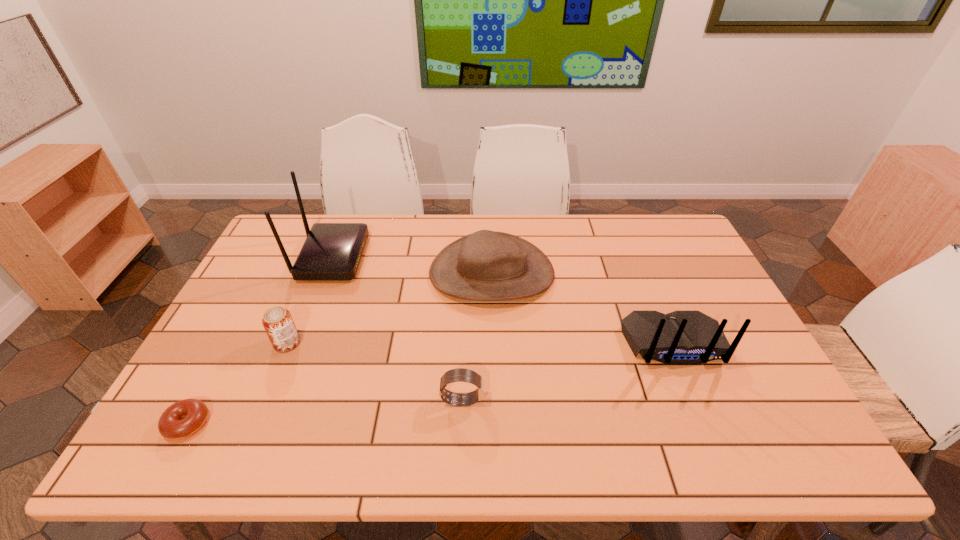
Locate an element on the screen. vacant space located 0.210m on the back of the fifth shortest object is located at coordinates (716, 448).

Identify the location of vacant area located on the front of the cowboy hat. (494, 357).

Image resolution: width=960 pixels, height=540 pixels. Find the location of `free region located on the right of the beer can`. free region located on the right of the beer can is located at coordinates (355, 343).

Identify the location of vacant area located 0.050m on the face of the watch. (504, 400).

The image size is (960, 540). I want to click on free location located on the back of the leftmost object, so click(x=206, y=387).

Where is `router that is positioned at the far edge`? The image size is (960, 540). router that is positioned at the far edge is located at coordinates (332, 251).

This screenshot has height=540, width=960. In order to click on cowboy hat situated at the far edge in this screenshot , I will do point(486,265).

At what (x,y) coordinates should I click in order to perform the action: click on object that is positioned at the near edge. Please return your answer as a coordinate pair (x, y). Looking at the image, I should click on (182, 419).

Where is `router that is at the left edge`? Image resolution: width=960 pixels, height=540 pixels. router that is at the left edge is located at coordinates (332, 251).

Locate an element on the screen. This screenshot has height=540, width=960. doughnut positioned at the left edge is located at coordinates (182, 419).